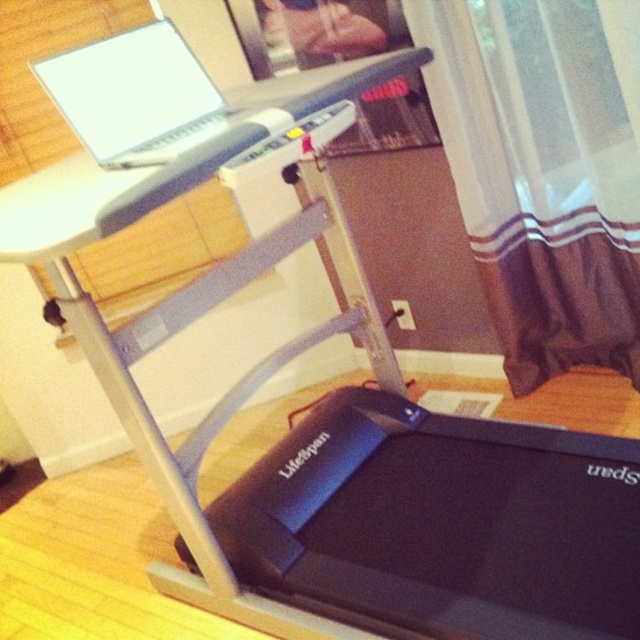
Question: Which point is closer to the camera taking this photo?

Choices:
 (A) (154, 161)
 (B) (547, 109)

Answer: (A)

Question: Can you confirm if brown sheer curtain at right is bigger than white matte laptop at upper left?

Choices:
 (A) yes
 (B) no

Answer: (A)

Question: Is brown sheer curtain at right to the right of white matte laptop at upper left from the viewer's perspective?

Choices:
 (A) no
 (B) yes

Answer: (B)

Question: Does brown sheer curtain at right have a smaller size compared to white matte laptop at upper left?

Choices:
 (A) no
 (B) yes

Answer: (A)

Question: Which point is farther to the camera?

Choices:
 (A) brown sheer curtain at right
 (B) white matte laptop at upper left

Answer: (A)